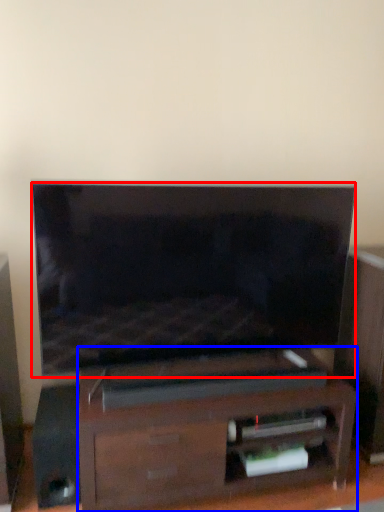
Question: Which of the following is the closest to the observer, television (highlighted by a red box) or furniture (highlighted by a blue box)?

Choices:
 (A) television
 (B) furniture

Answer: (A)